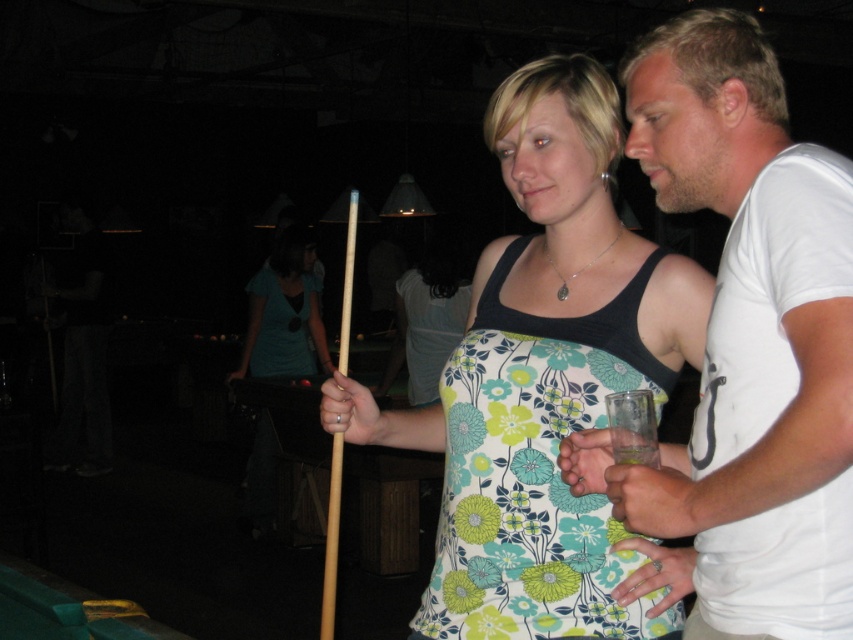
Question: Does matte blue shirt at center appear under green felt billiard table at lower left?

Choices:
 (A) yes
 (B) no

Answer: (B)

Question: Can you confirm if green felt billiard table at lower left is positioned to the right of wooden cue at center?

Choices:
 (A) yes
 (B) no

Answer: (B)

Question: Can you confirm if floral fabric dress at center is smaller than green felt billiard table at lower left?

Choices:
 (A) yes
 (B) no

Answer: (B)

Question: Estimate the real-world distances between objects in this image. Which object is closer to the green felt billiard table at lower left?

Choices:
 (A) floral fabric dress at center
 (B) matte blue shirt at center

Answer: (A)

Question: Which object appears closest to the camera in this image?

Choices:
 (A) wooden cue at center
 (B) green felt billiard table at lower left
 (C) white cotton t-shirt at upper right
 (D) matte blue shirt at center

Answer: (C)

Question: Estimate the real-world distances between objects in this image. Which object is farther from the white cotton t-shirt at upper right?

Choices:
 (A) floral fabric dress at center
 (B) matte blue shirt at center
 (C) green felt billiard table at lower left

Answer: (B)